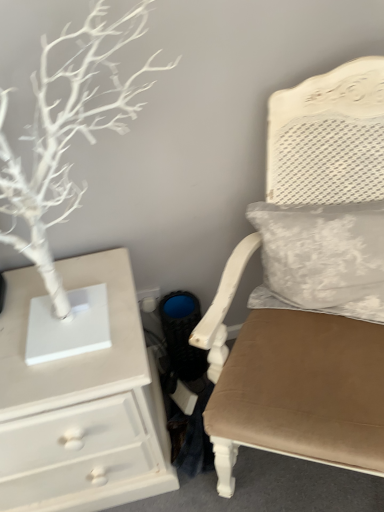
Question: Is white textured pillow at upper right positioned before velvet beige chair at center?

Choices:
 (A) yes
 (B) no

Answer: (B)

Question: Is white textured pillow at upper right located outside velvet beige chair at center?

Choices:
 (A) yes
 (B) no

Answer: (B)

Question: Is white textured pillow at upper right bigger than velvet beige chair at center?

Choices:
 (A) yes
 (B) no

Answer: (B)

Question: Does white textured pillow at upper right have a smaller size compared to velvet beige chair at center?

Choices:
 (A) no
 (B) yes

Answer: (B)

Question: Is white textured pillow at upper right placed right next to velvet beige chair at center?

Choices:
 (A) no
 (B) yes

Answer: (A)

Question: Does white textured pillow at upper right turn towards velvet beige chair at center?

Choices:
 (A) yes
 (B) no

Answer: (A)

Question: Considering the relative sizes of white matte tree at left and white painted wood chest of drawers at left in the image provided, is white matte tree at left thinner than white painted wood chest of drawers at left?

Choices:
 (A) yes
 (B) no

Answer: (A)

Question: Is white matte tree at left wider than white painted wood chest of drawers at left?

Choices:
 (A) no
 (B) yes

Answer: (A)

Question: Is white matte tree at left to the right of white painted wood chest of drawers at left from the viewer's perspective?

Choices:
 (A) no
 (B) yes

Answer: (B)

Question: Considering the relative positions of white matte tree at left and white painted wood chest of drawers at left in the image provided, is white matte tree at left to the left of white painted wood chest of drawers at left from the viewer's perspective?

Choices:
 (A) no
 (B) yes

Answer: (A)

Question: Is the position of white matte tree at left more distant than that of white painted wood chest of drawers at left?

Choices:
 (A) no
 (B) yes

Answer: (A)

Question: Is white matte tree at left located outside white painted wood chest of drawers at left?

Choices:
 (A) yes
 (B) no

Answer: (A)

Question: From the image's perspective, would you say velvet beige chair at center is positioned over white painted wood chest of drawers at left?

Choices:
 (A) no
 (B) yes

Answer: (B)